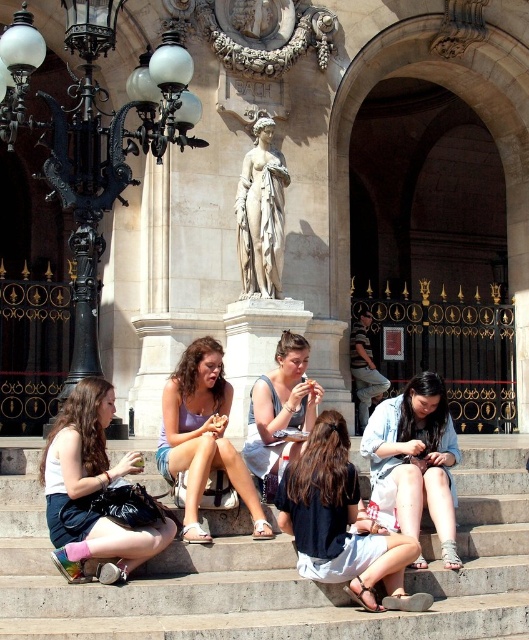
Is point (404, 540) farther from camera compared to point (289, 419)?

No.

Between dark blue denim skirt at center and light blue denim shorts at center, which one has less height?

Standing shorter between the two is light blue denim shorts at center.

This screenshot has width=529, height=640. Find the location of `dark blue denim skirt at center`. dark blue denim skirt at center is located at coordinates (341, 524).

Which is above, dark blue denim skirt at center or white marble statue at center?

white marble statue at center is above.

Can you confirm if dark blue denim skirt at center is shorter than white marble statue at center?

No.

Locate an element on the screen. dark blue denim skirt at center is located at coordinates (341, 524).

Find the location of a particular element. dark blue denim skirt at center is located at coordinates (341, 524).

Between light gray concrete stairs at center and light purple fabric dress at center, which one appears on the right side from the viewer's perspective?

light gray concrete stairs at center

Can you confirm if light gray concrete stairs at center is positioned below light purple fabric dress at center?

Yes, light gray concrete stairs at center is below light purple fabric dress at center.

Locate an element on the screen. The height and width of the screenshot is (640, 529). light gray concrete stairs at center is located at coordinates (271, 572).

Where is `light gray concrete stairs at center`? The image size is (529, 640). light gray concrete stairs at center is located at coordinates coord(271,572).